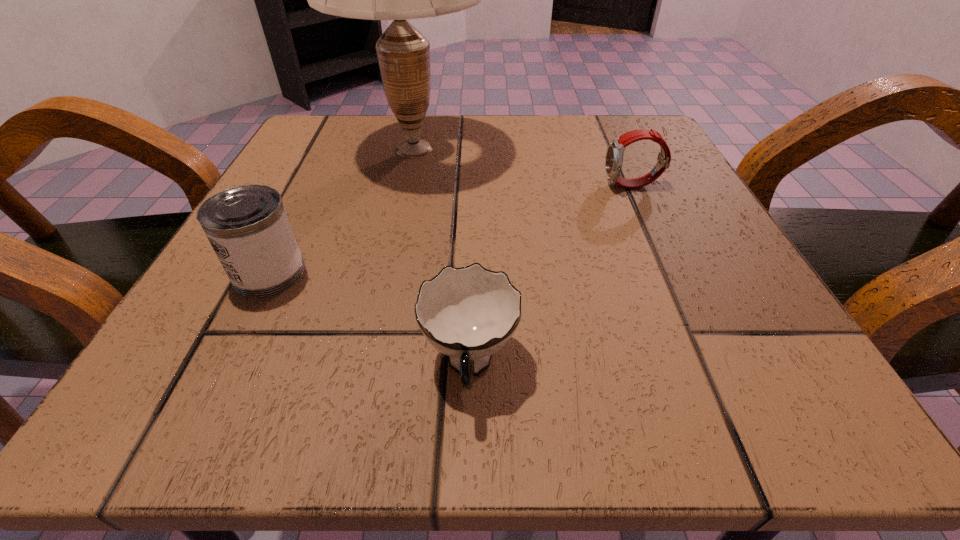
Identify the location of object that is the second closest to the watch. (468, 314).

This screenshot has width=960, height=540. Identify the location of object that is the second closest to the tallest object. (614, 156).

This screenshot has width=960, height=540. In order to click on vacant region that satisfies the following two spatial constraints: 1. on the face of the rightmost object; 2. on the side of the cup with the handle in this screenshot , I will do `click(714, 364)`.

Locate an element on the screen. vacant space that satisfies the following two spatial constraints: 1. on the face of the watch; 2. on the side of the cup with the handle is located at coordinates (714, 364).

Where is `blank space that satisfies the following two spatial constraints: 1. on the face of the watch; 2. on the side of the nearest object with the handle`? This screenshot has height=540, width=960. blank space that satisfies the following two spatial constraints: 1. on the face of the watch; 2. on the side of the nearest object with the handle is located at coordinates (714, 364).